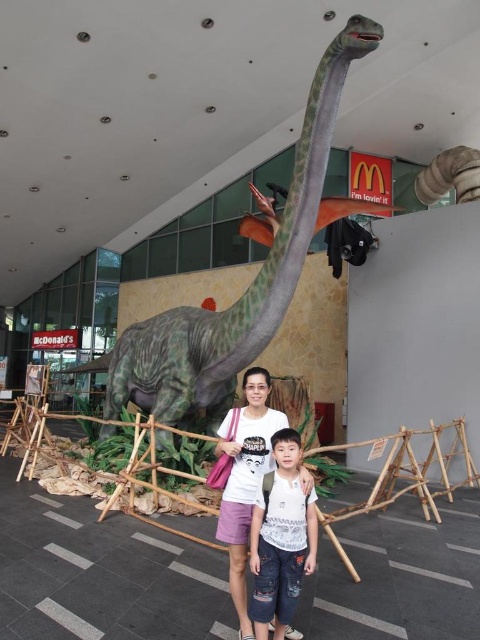
Question: Among these objects, which one is farthest from the camera?

Choices:
 (A) denim shorts at center
 (B) matte white shirt at center

Answer: (B)

Question: Does denim shorts at center appear on the right side of matte white shirt at center?

Choices:
 (A) no
 (B) yes

Answer: (B)

Question: In this image, where is denim shorts at center located relative to matte white shirt at center?

Choices:
 (A) above
 (B) below

Answer: (B)

Question: Does green matte dinosaur at center appear over denim shorts at center?

Choices:
 (A) no
 (B) yes

Answer: (B)

Question: Which object is farther from the camera taking this photo?

Choices:
 (A) denim shorts at center
 (B) matte white shirt at center

Answer: (B)

Question: Estimate the real-world distances between objects in this image. Which object is closer to the matte white shirt at center?

Choices:
 (A) green matte dinosaur at center
 (B) denim shorts at center

Answer: (B)